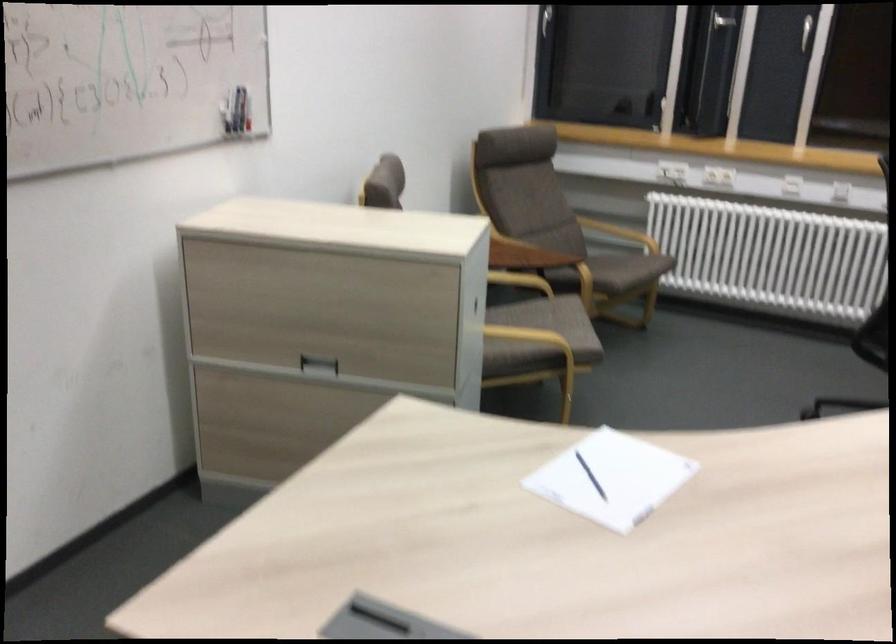
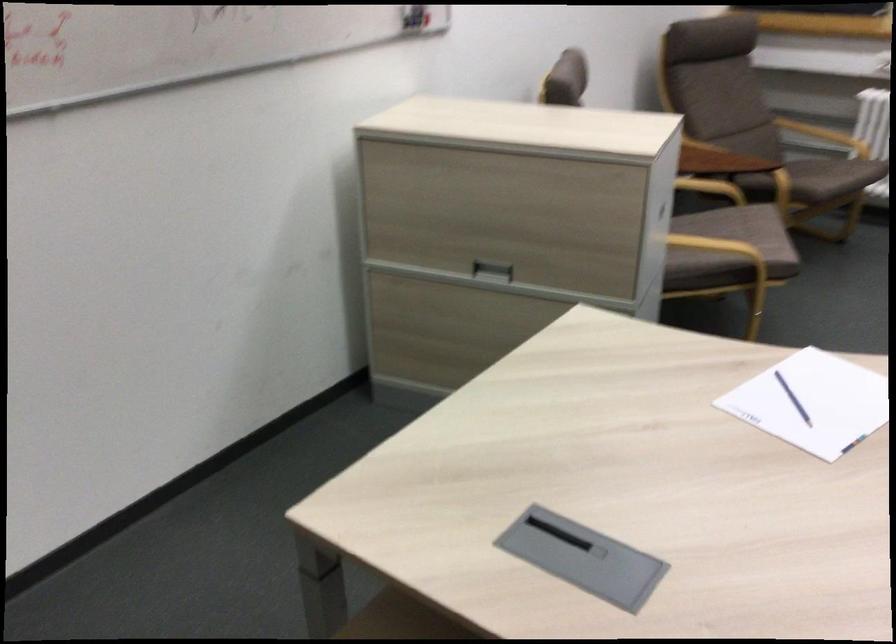
What movement of the cameraman would produce the second image?

The cameraman moved toward left, forward.